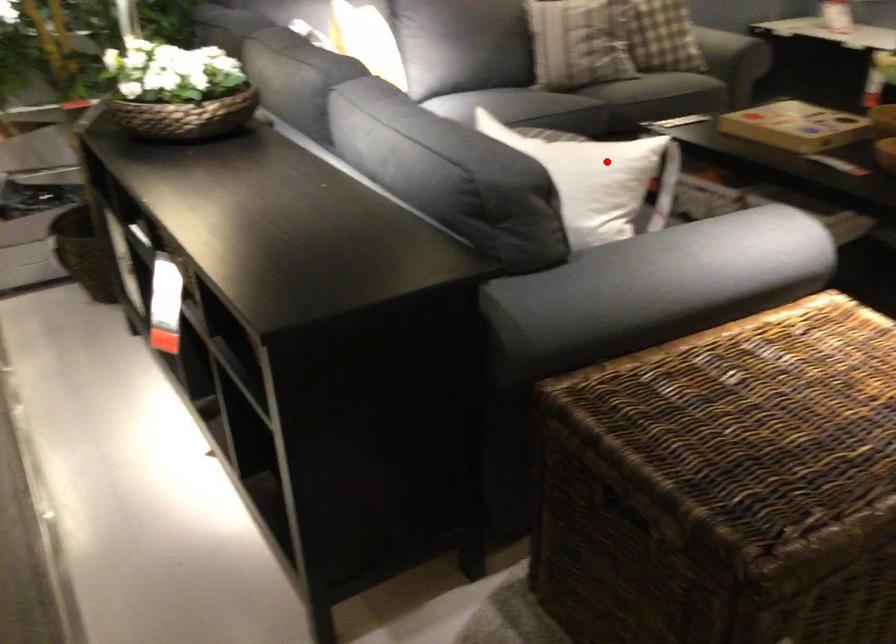
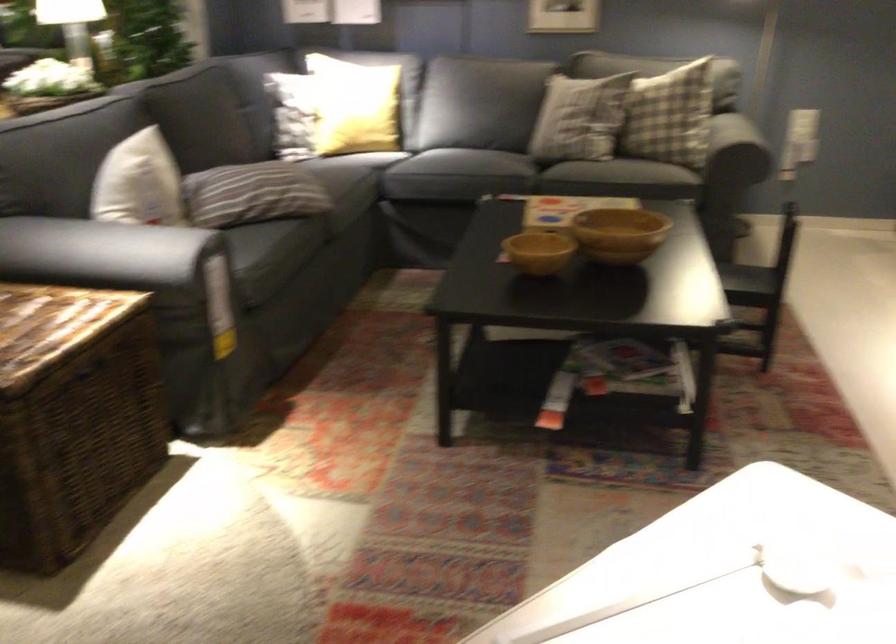
Question: I am providing you with two images of the same scene from different viewpoints. A red point is shown in image1. For the corresponding object point in image2, is it positioned nearer or farther from the camera?

Choices:
 (A) Nearer
 (B) Farther

Answer: (B)